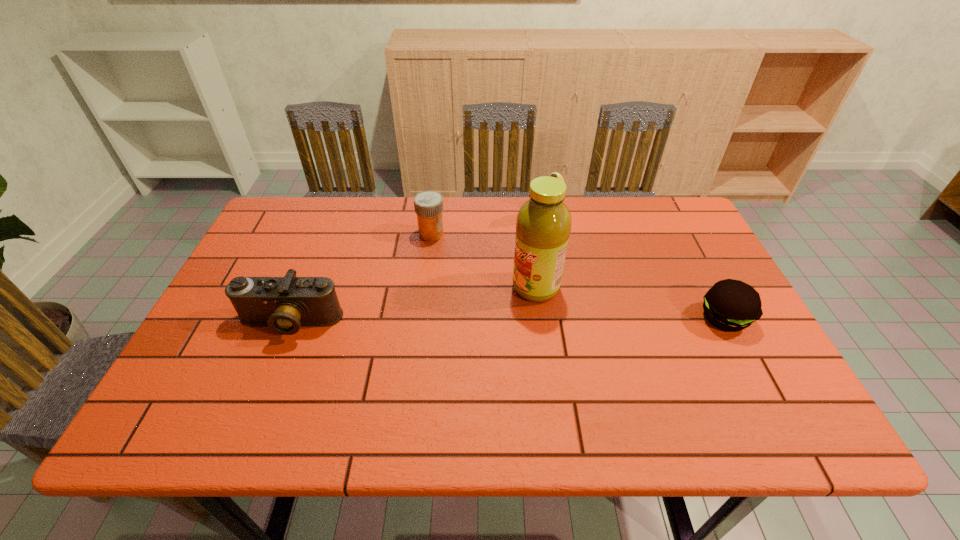
This screenshot has height=540, width=960. Find the location of `camera`. camera is located at coordinates (284, 304).

At what (x,y) coordinates should I click in order to perform the action: click on the rightmost object. Please return your answer as a coordinate pair (x, y). The image size is (960, 540). Looking at the image, I should click on (731, 305).

Image resolution: width=960 pixels, height=540 pixels. What are the coordinates of `the shortest object` in the screenshot? It's located at (731, 305).

Where is `the second tallest object`? The image size is (960, 540). the second tallest object is located at coordinates (554, 174).

This screenshot has height=540, width=960. I want to click on the tallest object, so click(x=543, y=225).

You are a GUI agent. You are given a task and a screenshot of the screen. Output one action in this format:
    pyautogui.click(x=<x>, y=<y>)
    Task: Click on the fourth object from right to left
    This screenshot has width=960, height=540.
    Given the screenshot: What is the action you would take?
    pyautogui.click(x=428, y=205)

Find the location of `vacant space located 0.060m on the lens of the leftmost object`. vacant space located 0.060m on the lens of the leftmost object is located at coordinates (274, 363).

This screenshot has width=960, height=540. In order to click on free space located on the left of the rightmost object in this screenshot , I will do `click(650, 318)`.

Where is `blank space located 0.320m from the stem of the second tallest object`? The width and height of the screenshot is (960, 540). blank space located 0.320m from the stem of the second tallest object is located at coordinates (495, 302).

Find the location of `vacant space positioned 0.280m from the stem of the second tallest object`. vacant space positioned 0.280m from the stem of the second tallest object is located at coordinates (503, 293).